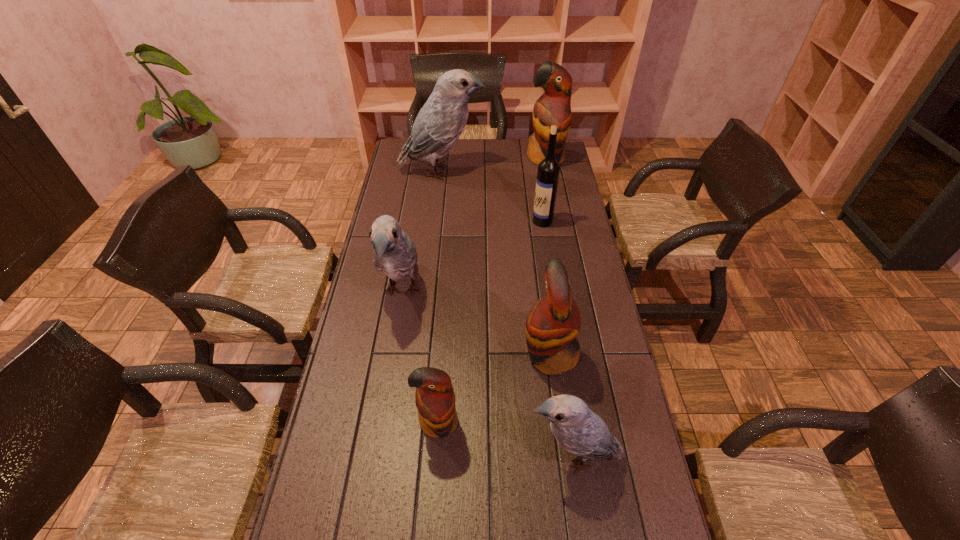
Locate an element on the screen. free point located 0.390m on the front-facing side of the second nearest gray parrot is located at coordinates [x=375, y=453].

The width and height of the screenshot is (960, 540). What are the coordinates of `blank area located 0.310m on the front-facing side of the rightmost gray parrot` in the screenshot? It's located at (402, 456).

This screenshot has height=540, width=960. What are the coordinates of `vacant space located on the front-facing side of the rightmost gray parrot` in the screenshot? It's located at (454, 456).

Locate an element on the screen. The width and height of the screenshot is (960, 540). vacant space positioned on the front-facing side of the rightmost gray parrot is located at coordinates (494, 456).

Locate an element on the screen. This screenshot has height=540, width=960. vacant space located on the face of the nearest red parrot is located at coordinates (433, 500).

The height and width of the screenshot is (540, 960). What are the coordinates of `wine bottle that is at the right edge` in the screenshot? It's located at (548, 172).

At what (x,y) coordinates should I click in order to perform the action: click on object at the far left corner. Please return your answer as a coordinate pair (x, y). This screenshot has width=960, height=540. Looking at the image, I should click on (440, 122).

Identify the location of object that is positioned at the far right corner. (553, 107).

Locate an element on the screen. This screenshot has height=540, width=960. vacant area at the far edge is located at coordinates (508, 154).

You are a GUI agent. You are given a task and a screenshot of the screen. Output one action in this format:
    pyautogui.click(x=<x>, y=<y>)
    Task: Click on the free space at the left edge of the desktop
    The width and height of the screenshot is (960, 540).
    Given the screenshot: What is the action you would take?
    pyautogui.click(x=418, y=211)